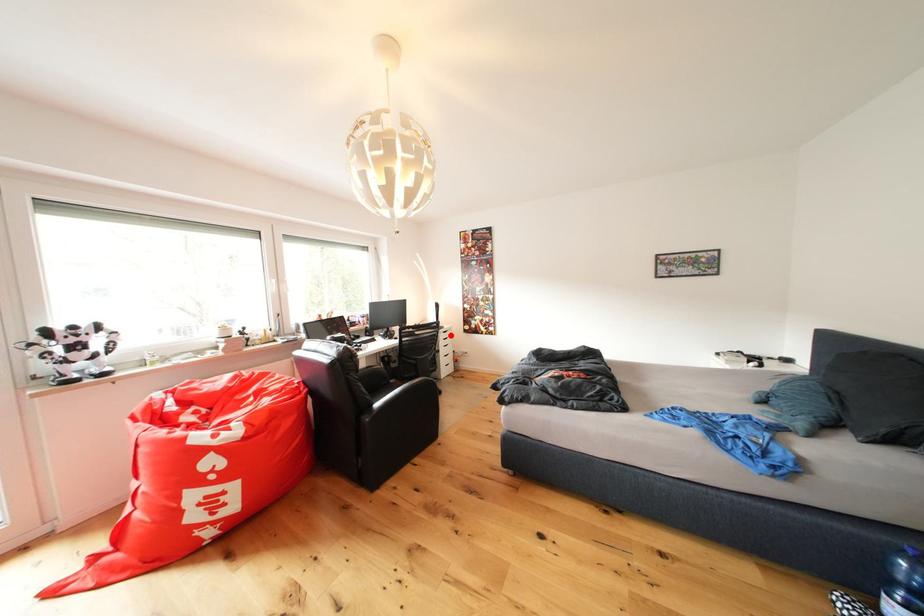
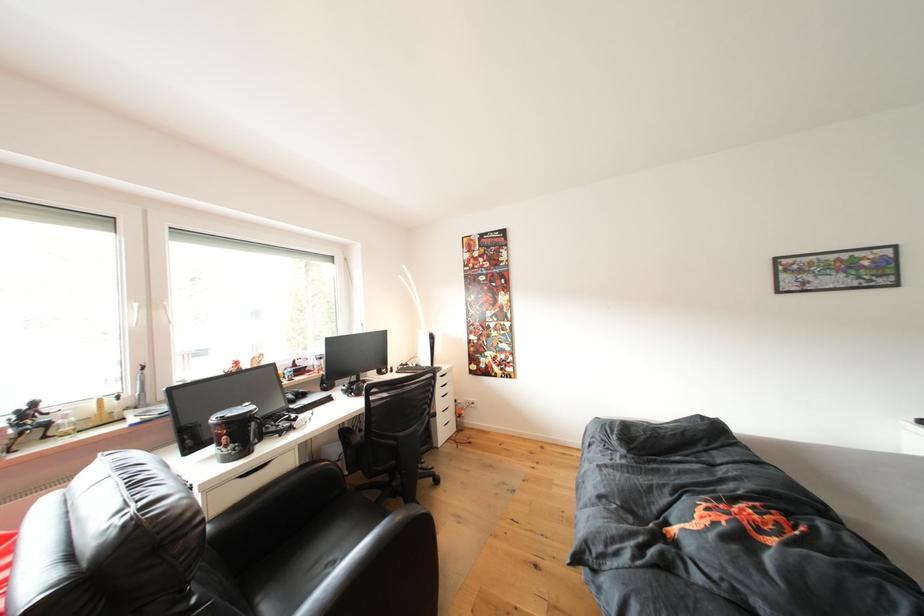
Question: I am providing you with two images of the same scene from different viewpoints. Image1 has a red point marked. In image2, the corresponding 3D location appears at what relative position? Reply with the corresponding letter.

Choices:
 (A) Closer
 (B) Farther

Answer: (B)